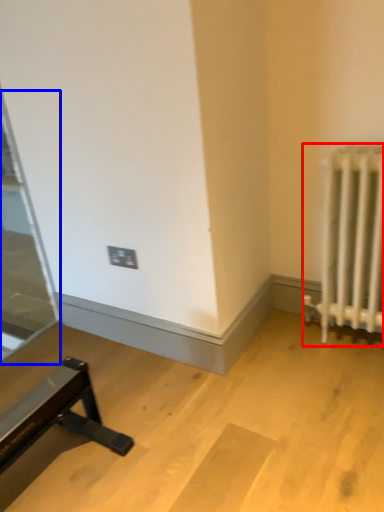
Question: Which of the following is the farthest to the observer, radiator (highlighted by a red box) or glass door (highlighted by a blue box)?

Choices:
 (A) radiator
 (B) glass door

Answer: (B)